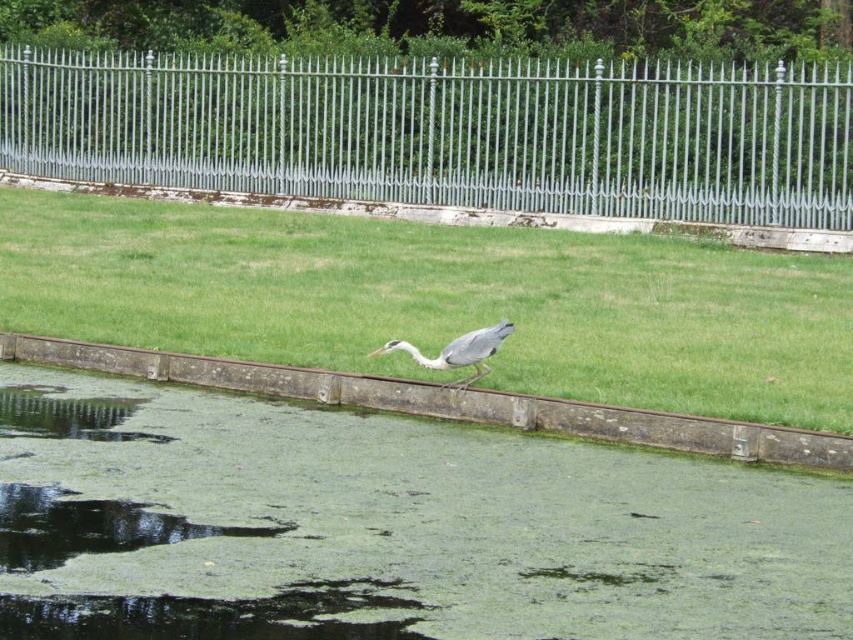
Question: Does green grass at center have a larger size compared to brown concrete ledge at center?

Choices:
 (A) yes
 (B) no

Answer: (A)

Question: Is silver metallic fence at upper center bigger than brown concrete ledge at center?

Choices:
 (A) yes
 (B) no

Answer: (A)

Question: Estimate the real-world distances between objects in this image. Which object is closer to the brown concrete ledge at center?

Choices:
 (A) silver metallic fence at upper center
 (B) green algae-covered water at center
 (C) green grass at center

Answer: (B)

Question: Is green grass at center closer to camera compared to silver metallic fence at upper center?

Choices:
 (A) no
 (B) yes

Answer: (B)

Question: Which is nearer to the silver metallic fence at upper center?

Choices:
 (A) green algae-covered water at center
 (B) green grass at center
 (C) brown concrete ledge at center
 (D) gray matte bird at center

Answer: (B)

Question: Considering the real-world distances, which object is closest to the brown concrete ledge at center?

Choices:
 (A) silver metallic fence at upper center
 (B) green algae-covered water at center

Answer: (B)